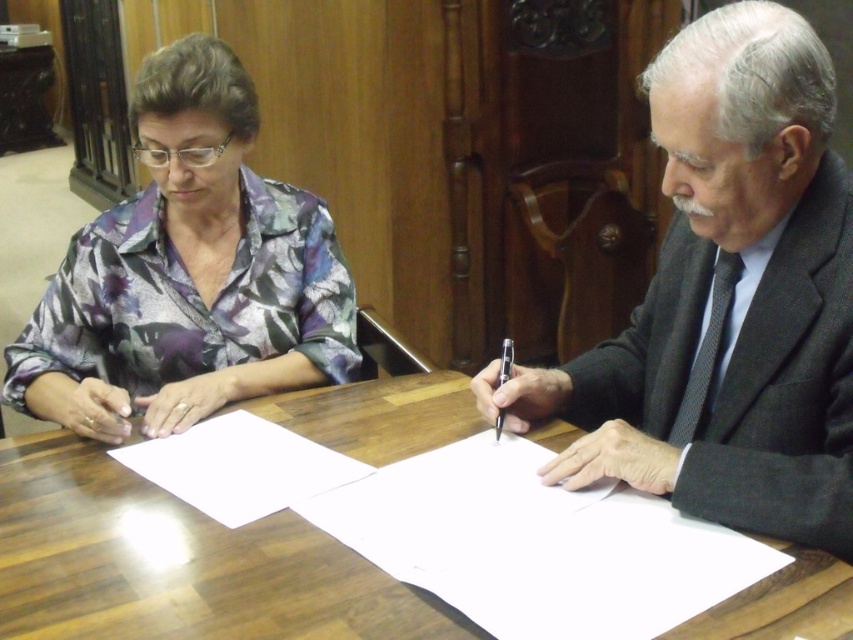
Question: Among these objects, which one is farthest from the camera?

Choices:
 (A) dark gray suit at center
 (B) wooden table at center
 (C) black plastic pen at center

Answer: (C)

Question: Does dark gray suit at center appear on the left side of wooden table at center?

Choices:
 (A) yes
 (B) no

Answer: (B)

Question: Which point is closer to the camera taking this photo?

Choices:
 (A) (155, 291)
 (B) (509, 374)
 (C) (105, 525)

Answer: (C)

Question: Estimate the real-world distances between objects in this image. Which object is farther from the black plastic pen at center?

Choices:
 (A) floral fabric blouse at left
 (B) wooden table at center
 (C) dark gray suit at center

Answer: (A)

Question: Can you confirm if wooden table at center is positioned above floral fabric blouse at left?

Choices:
 (A) yes
 (B) no

Answer: (B)

Question: Observing the image, what is the correct spatial positioning of wooden table at center in reference to black plastic pen at center?

Choices:
 (A) right
 (B) left

Answer: (B)